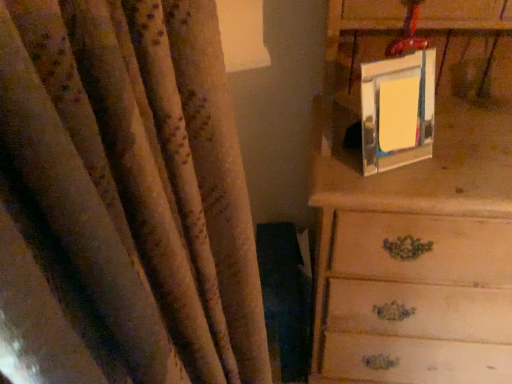
Describe the element at coordinates (397, 111) in the screenshot. This screenshot has height=384, width=512. I see `metallic reflective picture frame at upper right` at that location.

Where is `metallic reflective picture frame at upper right`? metallic reflective picture frame at upper right is located at coordinates (397, 111).

The height and width of the screenshot is (384, 512). I want to click on wooden chest of drawers at upper right, so click(416, 205).

Image resolution: width=512 pixels, height=384 pixels. What do you see at coordinates (416, 205) in the screenshot?
I see `wooden chest of drawers at upper right` at bounding box center [416, 205].

Image resolution: width=512 pixels, height=384 pixels. In order to click on metallic reflective picture frame at upper right in this screenshot , I will do `click(397, 111)`.

Can you confirm if wooden chest of drawers at upper right is positioned to the left of metallic reflective picture frame at upper right?

In fact, wooden chest of drawers at upper right is to the right of metallic reflective picture frame at upper right.

Is wooden chest of drawers at upper right in front of or behind metallic reflective picture frame at upper right in the image?

wooden chest of drawers at upper right is in front of metallic reflective picture frame at upper right.

Which point is more distant from viewer, (409,340) or (403,65)?

The point (409,340) is more distant.

From the image's perspective, who appears lower, wooden chest of drawers at upper right or metallic reflective picture frame at upper right?

wooden chest of drawers at upper right appears lower in the image.

From a real-world perspective, relative to metallic reflective picture frame at upper right, is wooden chest of drawers at upper right vertically above or below?

In terms of real-world spatial position, wooden chest of drawers at upper right is below metallic reflective picture frame at upper right.

In the scene shown: Can you confirm if wooden chest of drawers at upper right is wider than metallic reflective picture frame at upper right?

Yes.

Is wooden chest of drawers at upper right shorter than metallic reflective picture frame at upper right?

No.

Which of these two, wooden chest of drawers at upper right or metallic reflective picture frame at upper right, is bigger?

Bigger between the two is wooden chest of drawers at upper right.

Is wooden chest of drawers at upper right positioned beyond the bounds of metallic reflective picture frame at upper right?

Yes, wooden chest of drawers at upper right is outside of metallic reflective picture frame at upper right.

Are wooden chest of drawers at upper right and metallic reflective picture frame at upper right far apart?

No, wooden chest of drawers at upper right is not far from metallic reflective picture frame at upper right.

Is wooden chest of drawers at upper right oriented away from metallic reflective picture frame at upper right?

Yes, metallic reflective picture frame at upper right is at the back of wooden chest of drawers at upper right.

Looking at this image, can you tell me how much wooden chest of drawers at upper right and metallic reflective picture frame at upper right differ in facing direction?

The facing directions of wooden chest of drawers at upper right and metallic reflective picture frame at upper right are 27.9 degrees apart.

Where is `picture frame above the wooden chest of drawers at upper right (from the image's perspective)`? The image size is (512, 384). picture frame above the wooden chest of drawers at upper right (from the image's perspective) is located at coordinates (397, 111).

Does metallic reflective picture frame at upper right appear on the right side of wooden chest of drawers at upper right?

In fact, metallic reflective picture frame at upper right is to the left of wooden chest of drawers at upper right.

Considering the positions of objects metallic reflective picture frame at upper right and wooden chest of drawers at upper right in the image provided, who is behind, metallic reflective picture frame at upper right or wooden chest of drawers at upper right?

metallic reflective picture frame at upper right is further from the camera.

Is point (400, 91) closer or farther from the camera than point (349, 172)?

Clearly, point (400, 91) is closer to the camera than point (349, 172).

Consider the image. From the image's perspective, is metallic reflective picture frame at upper right over wooden chest of drawers at upper right?

Yes.

From a real-world perspective, between metallic reflective picture frame at upper right and wooden chest of drawers at upper right, who is vertically higher?

metallic reflective picture frame at upper right.

From the picture: Which of these two, metallic reflective picture frame at upper right or wooden chest of drawers at upper right, is thinner?

metallic reflective picture frame at upper right is thinner.

Is metallic reflective picture frame at upper right taller or shorter than wooden chest of drawers at upper right?

In the image, metallic reflective picture frame at upper right appears to be shorter than wooden chest of drawers at upper right.

Who is bigger, metallic reflective picture frame at upper right or wooden chest of drawers at upper right?

wooden chest of drawers at upper right is bigger.

Is metallic reflective picture frame at upper right positioned beyond the bounds of wooden chest of drawers at upper right?

No.

Is metallic reflective picture frame at upper right touching wooden chest of drawers at upper right?

There is a gap between metallic reflective picture frame at upper right and wooden chest of drawers at upper right.

Is metallic reflective picture frame at upper right aimed at wooden chest of drawers at upper right?

Yes, metallic reflective picture frame at upper right is oriented towards wooden chest of drawers at upper right.

What's the angular difference between metallic reflective picture frame at upper right and wooden chest of drawers at upper right's facing directions?

The angular difference between metallic reflective picture frame at upper right and wooden chest of drawers at upper right is 27.9 degrees.

What are the coordinates of `the chest of drawers below the metallic reflective picture frame at upper right (from the image's perspective)` in the screenshot? It's located at click(416, 205).

The width and height of the screenshot is (512, 384). I want to click on picture frame above the wooden chest of drawers at upper right (from the image's perspective), so click(397, 111).

Locate an element on the screen. This screenshot has width=512, height=384. picture frame located on the left of wooden chest of drawers at upper right is located at coordinates (397, 111).